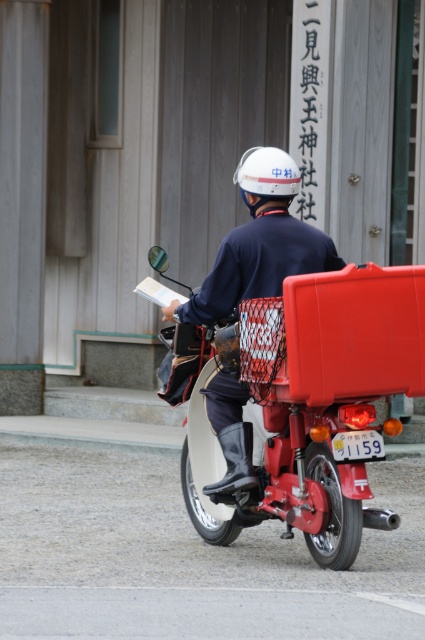
Does point (295, 374) lie behind point (288, 193)?

No, it is not.

What do you see at coordinates (316, 404) in the screenshot? I see `metallic red motorcycle at center` at bounding box center [316, 404].

Image resolution: width=425 pixels, height=640 pixels. Identify the location of metallic red motorcycle at center. (316, 404).

Is matte white helmet at upper center to the right of white matte helmet at center from the viewer's perspective?

In fact, matte white helmet at upper center is to the left of white matte helmet at center.

Between matte white helmet at upper center and white matte helmet at center, which one is positioned lower?

matte white helmet at upper center

Identify the location of matte white helmet at upper center. (260, 241).

Does point (289, 465) come in front of point (272, 198)?

No, (289, 465) is behind (272, 198).

Does point (345, 408) come behind point (240, 465)?

No, it is not.

Is point (314, 541) positioned in front of point (292, 179)?

No, it is behind (292, 179).

Find the location of a particular element. metallic red motorcycle at center is located at coordinates (316, 404).